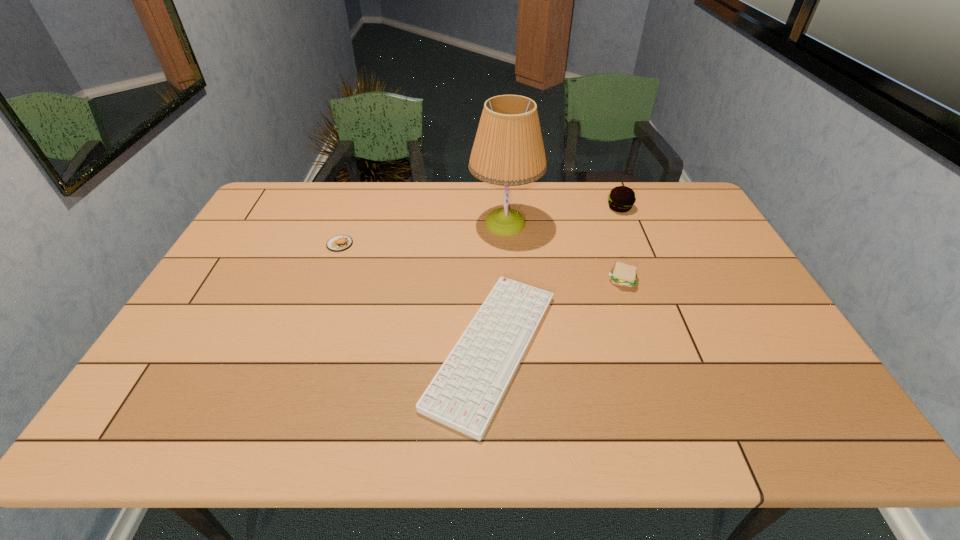
Where is `vacant space located 0.190m on the left of the tallest patty`? This screenshot has height=540, width=960. vacant space located 0.190m on the left of the tallest patty is located at coordinates (552, 208).

Where is `vacant space located 0.160m on the front of the nearest patty`? vacant space located 0.160m on the front of the nearest patty is located at coordinates (640, 335).

Locate an element on the screen. vacant space located 0.340m on the right of the leftmost object is located at coordinates (460, 244).

Locate an element on the screen. Image resolution: width=960 pixels, height=540 pixels. vacant region located on the back of the shortest object is located at coordinates (491, 259).

Where is `lamp located at the far edge`? This screenshot has width=960, height=540. lamp located at the far edge is located at coordinates (508, 150).

The image size is (960, 540). In order to click on patty that is at the far edge in this screenshot , I will do `click(621, 198)`.

Locate an element on the screen. object present at the near edge is located at coordinates (465, 393).

Where is `free spot at the far edge of the desktop`? The height and width of the screenshot is (540, 960). free spot at the far edge of the desktop is located at coordinates click(524, 194).

Where is `vacant space at the left edge of the desktop`? vacant space at the left edge of the desktop is located at coordinates (181, 374).

The image size is (960, 540). I want to click on free space at the right edge, so click(802, 367).